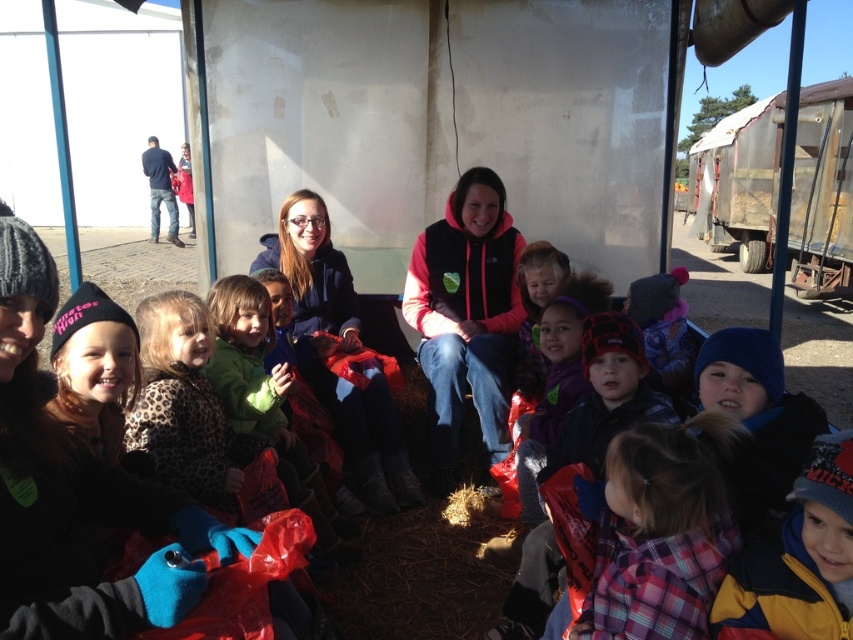
Question: Which object is closer to the camera taking this photo?

Choices:
 (A) yellow fleece jacket at lower right
 (B) plaid fabric at lower center

Answer: (A)

Question: Is plaid fabric at lower center thinner than yellow fleece jacket at lower right?

Choices:
 (A) no
 (B) yes

Answer: (A)

Question: Which of the following is the closest to the observer?

Choices:
 (A) (401, 474)
 (B) (712, 632)
 (C) (697, 509)
 (D) (428, 284)

Answer: (B)

Question: Is plaid fabric at lower center bigger than leopard print coat at center?

Choices:
 (A) no
 (B) yes

Answer: (A)

Question: Which point is farther to the camera?

Choices:
 (A) plaid fabric at lower center
 (B) matte blue hoodie at center
 (C) leopard print coat at center
 (D) pink fleece vest at center

Answer: (D)

Question: Is plaid fabric at lower center to the right of matte blue hoodie at center from the viewer's perspective?

Choices:
 (A) no
 (B) yes

Answer: (B)